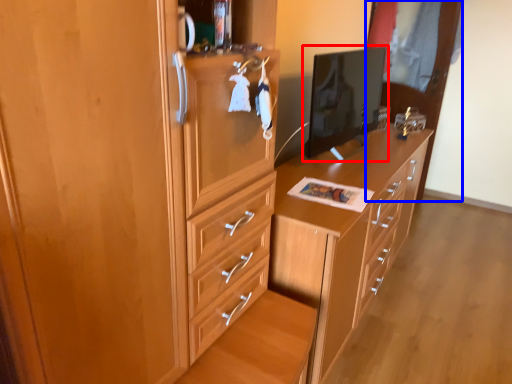
Question: Which of the following is the farthest to the observer, computer monitor (highlighted by a red box) or glass door (highlighted by a blue box)?

Choices:
 (A) computer monitor
 (B) glass door

Answer: (B)